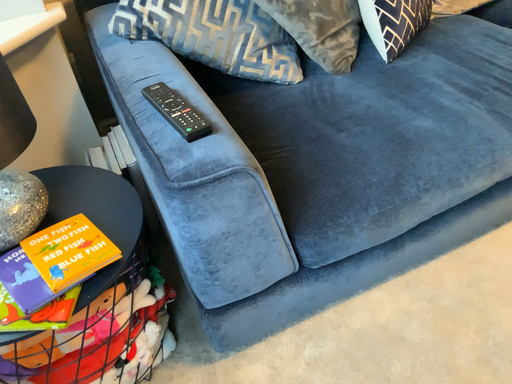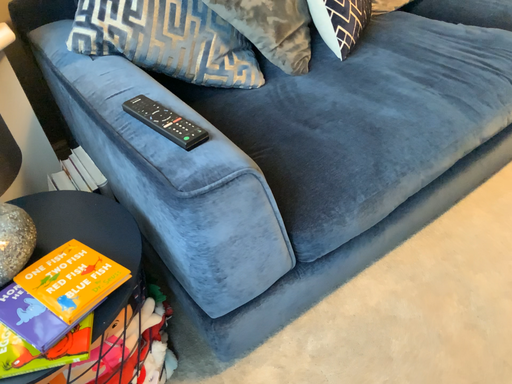
Question: How did the camera likely rotate when shooting the video?

Choices:
 (A) rotated right
 (B) rotated left

Answer: (A)